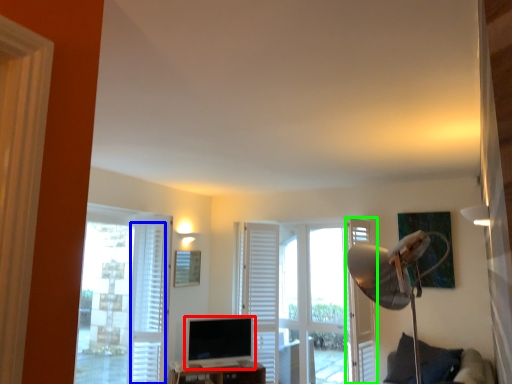
Question: Which object is positioned closest to computer monitor (highlighted by a red box)? Select from curtain (highlighted by a blue box) and screen door (highlighted by a green box).

Choices:
 (A) curtain
 (B) screen door

Answer: (A)